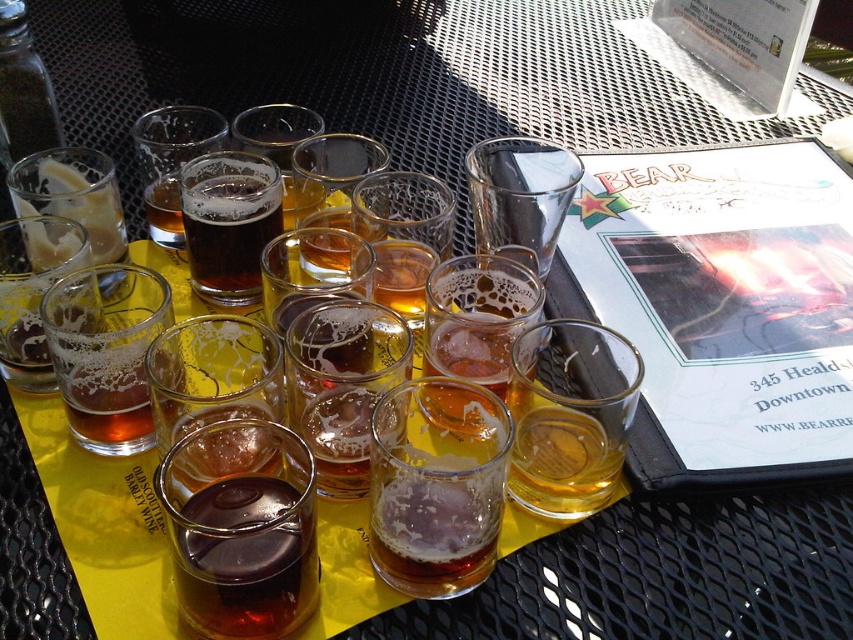
Question: Which point appears farthest from the camera in this image?

Choices:
 (A) (509, 145)
 (B) (611, 419)
 (C) (280, 202)

Answer: (A)

Question: Does dark matte glass at center come behind clear glass at center?

Choices:
 (A) yes
 (B) no

Answer: (A)

Question: Which of the following is the farthest from the observer?

Choices:
 (A) clear glass at center
 (B) matte glass beer at center
 (C) translucent amber glass at center

Answer: (B)

Question: Can you confirm if translucent frosted glass at center-left is bigger than dark matte glass at center?

Choices:
 (A) no
 (B) yes

Answer: (B)

Question: Observing the image, what is the correct spatial positioning of translucent frosted glass at center-left in reference to dark matte glass at center?

Choices:
 (A) below
 (B) above

Answer: (A)

Question: Which point is farther to the camera?

Choices:
 (A) dark matte glass at center
 (B) translucent frosted glass at center-left

Answer: (A)